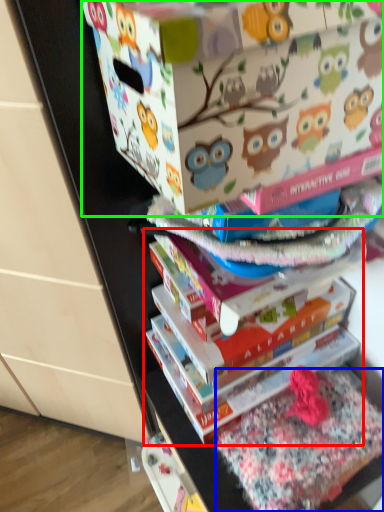
Question: Which object is positioned closest to book (highlighted by a red box)? Select from fabric (highlighted by a blue box) and cardboard box (highlighted by a green box).

Choices:
 (A) fabric
 (B) cardboard box

Answer: (A)